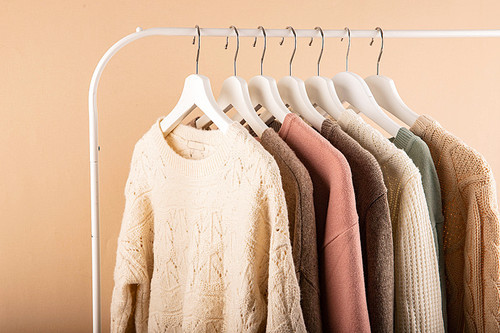
This screenshot has height=333, width=500. Identify the location of high end clothes hanger. (193, 89), (231, 88), (264, 89), (291, 89), (322, 86), (354, 85), (380, 85).